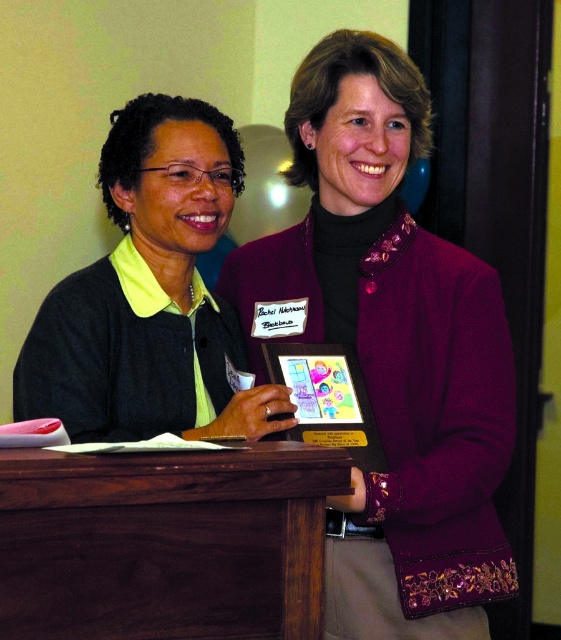
Is purple satin jacket at center taller than dark brown wood table at center?

Yes.

Who is taller, purple satin jacket at center or dark brown wood table at center?

purple satin jacket at center is taller.

At what (x,y) coordinates should I click in order to perform the action: click on purple satin jacket at center. Please return your answer as a coordinate pair (x, y). The width and height of the screenshot is (561, 640). Looking at the image, I should click on (393, 348).

Identify the location of purple satin jacket at center. (393, 348).

In the scene shown: Is purple satin jacket at center taller than matte black sweater at center?

Yes, purple satin jacket at center is taller than matte black sweater at center.

Can you confirm if purple satin jacket at center is bigger than matte black sweater at center?

Yes.

This screenshot has height=640, width=561. Describe the element at coordinates (393, 348) in the screenshot. I see `purple satin jacket at center` at that location.

Identify the location of purple satin jacket at center. (393, 348).

Does dark brown wood table at center appear over matte black sweater at center?

Incorrect, dark brown wood table at center is not positioned above matte black sweater at center.

Who is more forward, (214, 516) or (200, 432)?

Positioned in front is point (214, 516).

Who is more distant from viewer, (187, 547) or (226, 200)?

Positioned behind is point (226, 200).

Locate an element on the screen. The width and height of the screenshot is (561, 640). dark brown wood table at center is located at coordinates (165, 541).